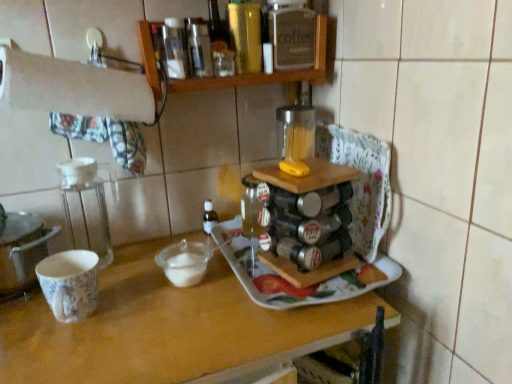
This screenshot has width=512, height=384. Find the location of `free space above wooden tray at center (from a real-world perspective)`. free space above wooden tray at center (from a real-world perspective) is located at coordinates (170, 301).